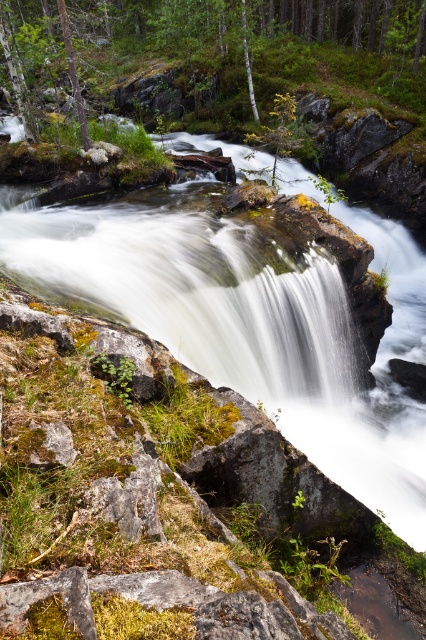
Is green mossy rock at upper center shorter than white smooth tree at center?

Incorrect, green mossy rock at upper center's height does not fall short of white smooth tree at center's.

Between point (172, 51) and point (256, 120), which one is positioned behind?

The point (172, 51) is more distant.

This screenshot has width=426, height=640. Describe the element at coordinates (250, 36) in the screenshot. I see `green mossy rock at upper center` at that location.

Find the location of a particular element. green mossy rock at upper center is located at coordinates (250, 36).

Is white smooth water at center positioned at the back of green mossy rock at upper center?

No, it is in front of green mossy rock at upper center.

Who is more forward, (362, 468) or (238, 16)?

Positioned in front is point (362, 468).

Is point (380, 490) positioned before point (52, 36)?

Yes, point (380, 490) is in front of point (52, 36).

Locate an element on the screen. white smooth water at center is located at coordinates (247, 323).

Does white smooth water at center appear over white smooth tree at center?

No.

Is point (247, 272) positioned in front of point (249, 67)?

That is True.

Where is `white smooth water at center`? This screenshot has width=426, height=640. white smooth water at center is located at coordinates (247, 323).